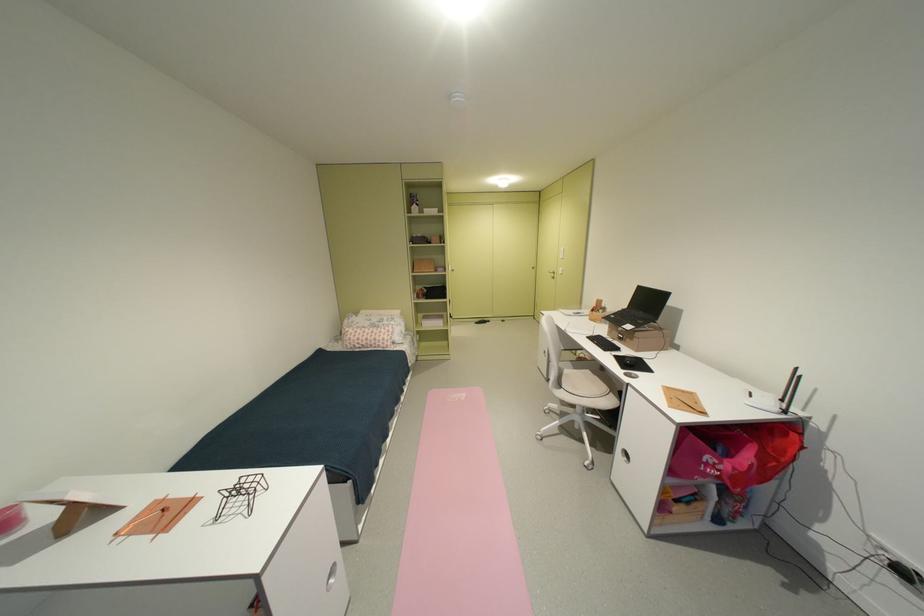
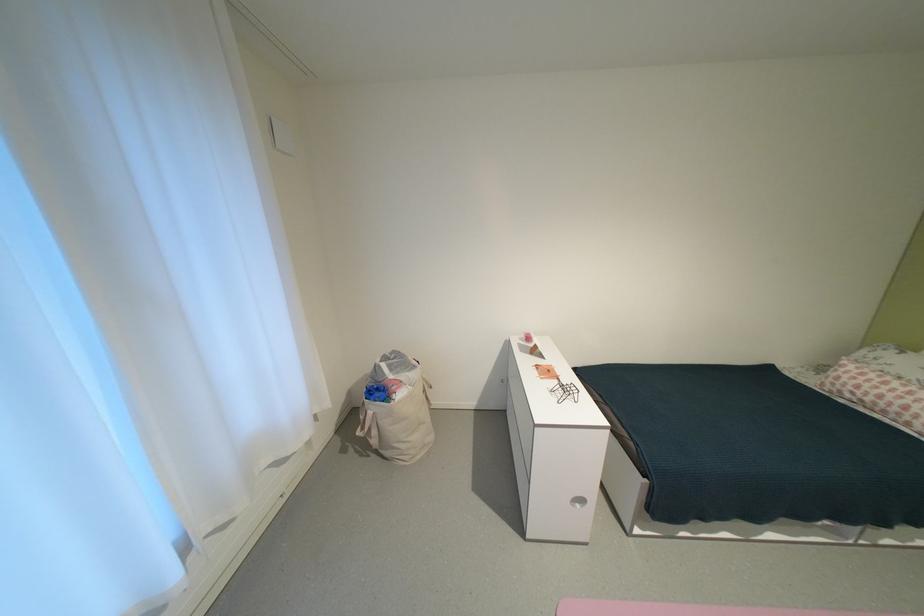
The point at [341,583] is marked in the first image. Where is the corresponding point in the second image?

(588, 506)